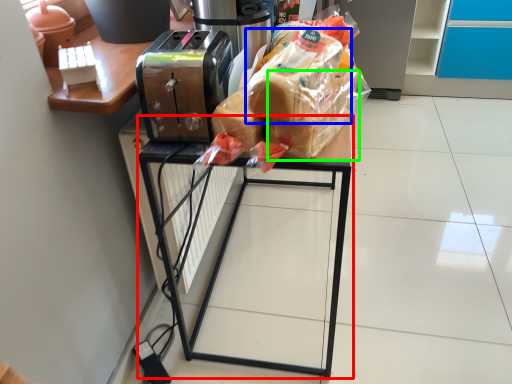
Question: Which object is the closest to the furniture (highlighted by a red box)? Choose among these: bread (highlighted by a blue box) or bread (highlighted by a green box).

Choices:
 (A) bread
 (B) bread

Answer: (A)